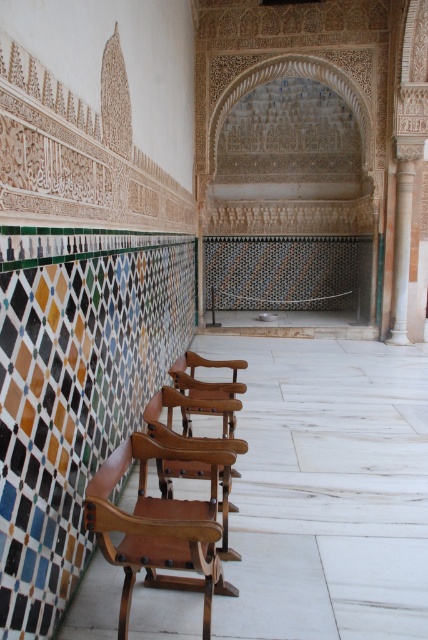
Does brown leather chair at left have a larger size compared to green marble column at right?

No, brown leather chair at left is not bigger than green marble column at right.

Based on the photo, between brown leather chair at left and green marble column at right, which one has more height?

green marble column at right

Locate an element on the screen. The width and height of the screenshot is (428, 640). brown leather chair at left is located at coordinates (158, 528).